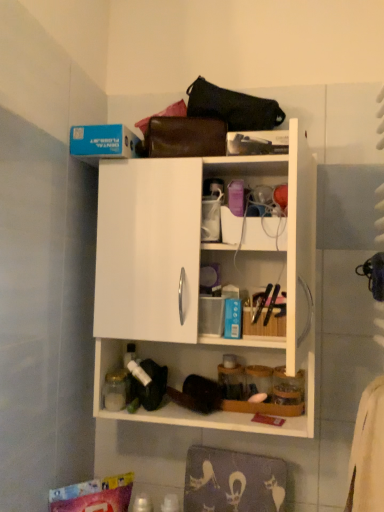
Locate an element on the screen. The image size is (384, 512). black leather handbag at upper center, the first handbag from the top is located at coordinates (232, 106).

Locate an element on the screen. The image size is (384, 512). black leather handbag at upper center, the first handbag from the top is located at coordinates (232, 106).

Between leather handbag at upper center, acting as the second handbag starting from the top, and white matte cabinet at upper center, which one has smaller size?

Smaller between the two is leather handbag at upper center, acting as the second handbag starting from the top.

From the image's perspective, is leather handbag at upper center, acting as the first handbag starting from the bottom, located above white matte cabinet at upper center?

Yes, from the image's perspective, leather handbag at upper center, acting as the first handbag starting from the bottom, is above white matte cabinet at upper center.

Is leather handbag at upper center, acting as the first handbag starting from the bottom, at the left side of white matte cabinet at upper center?

Correct, you'll find leather handbag at upper center, acting as the first handbag starting from the bottom, to the left of white matte cabinet at upper center.

Looking at this image, considering the relative positions of white matte cabinet at upper center and leather handbag at upper center, acting as the second handbag starting from the top, in the image provided, is white matte cabinet at upper center to the right of leather handbag at upper center, acting as the second handbag starting from the top, from the viewer's perspective?

Indeed, white matte cabinet at upper center is positioned on the right side of leather handbag at upper center, acting as the second handbag starting from the top.

Considering the relative sizes of white matte cabinet at upper center and leather handbag at upper center, acting as the second handbag starting from the top, in the image provided, is white matte cabinet at upper center bigger than leather handbag at upper center, acting as the second handbag starting from the top,?

Indeed, white matte cabinet at upper center has a larger size compared to leather handbag at upper center, acting as the second handbag starting from the top.

From their relative heights in the image, would you say white matte cabinet at upper center is taller or shorter than leather handbag at upper center, acting as the second handbag starting from the top?

In the image, white matte cabinet at upper center appears to be taller than leather handbag at upper center, acting as the second handbag starting from the top.

Looking at their sizes, would you say white matte cabinet at upper center is wider or thinner than leather handbag at upper center, acting as the first handbag starting from the bottom?

Clearly, white matte cabinet at upper center has more width compared to leather handbag at upper center, acting as the first handbag starting from the bottom.

Is black leather handbag at upper center, which is the second handbag in bottom-to-top order, far away from white matte cabinet at upper center?

No, black leather handbag at upper center, which is the second handbag in bottom-to-top order, is not far from white matte cabinet at upper center.

Is black leather handbag at upper center, which is the second handbag in bottom-to-top order, wider or thinner than white matte cabinet at upper center?

In the image, black leather handbag at upper center, which is the second handbag in bottom-to-top order, appears to be more narrow than white matte cabinet at upper center.

From a real-world perspective, relative to white matte cabinet at upper center, is black leather handbag at upper center, the first handbag from the top, vertically above or below?

In terms of real-world spatial position, black leather handbag at upper center, the first handbag from the top, is above white matte cabinet at upper center.

Is point (216, 106) farther from camera compared to point (176, 167)?

Yes, point (216, 106) is behind point (176, 167).

From a real-world perspective, is black leather handbag at upper center, which is the second handbag in bottom-to-top order, physically located above or below leather handbag at upper center, acting as the first handbag starting from the bottom?

From a real-world perspective, black leather handbag at upper center, which is the second handbag in bottom-to-top order, is physically above leather handbag at upper center, acting as the first handbag starting from the bottom.

What's the angular difference between black leather handbag at upper center, which is the second handbag in bottom-to-top order, and leather handbag at upper center, acting as the first handbag starting from the bottom,'s facing directions?

They differ by 6.21 degrees in their facing directions.

Does point (249, 111) come in front of point (163, 143)?

Yes, it is in front of point (163, 143).

In the image, is black leather handbag at upper center, the first handbag from the top, positioned in front of or behind leather handbag at upper center, acting as the second handbag starting from the top?

Visually, black leather handbag at upper center, the first handbag from the top, is located in front of leather handbag at upper center, acting as the second handbag starting from the top.

Are leather handbag at upper center, acting as the second handbag starting from the top, and black leather handbag at upper center, the first handbag from the top, located far from each other?

No, leather handbag at upper center, acting as the second handbag starting from the top, is in close proximity to black leather handbag at upper center, the first handbag from the top.

Looking at this image, between leather handbag at upper center, acting as the first handbag starting from the bottom, and black leather handbag at upper center, the first handbag from the top, which one has larger width?

black leather handbag at upper center, the first handbag from the top, is wider.

Could you tell me if leather handbag at upper center, acting as the first handbag starting from the bottom, is facing black leather handbag at upper center, which is the second handbag in bottom-to-top order?

No, leather handbag at upper center, acting as the first handbag starting from the bottom, does not turn towards black leather handbag at upper center, which is the second handbag in bottom-to-top order.

Looking at their sizes, would you say white matte cabinet at upper center is wider or thinner than black leather handbag at upper center, the first handbag from the top?

white matte cabinet at upper center is wider than black leather handbag at upper center, the first handbag from the top.

From their relative heights in the image, would you say white matte cabinet at upper center is taller or shorter than black leather handbag at upper center, which is the second handbag in bottom-to-top order?

white matte cabinet at upper center is taller than black leather handbag at upper center, which is the second handbag in bottom-to-top order.

From the image's perspective, which object appears higher, white matte cabinet at upper center or black leather handbag at upper center, the first handbag from the top?

black leather handbag at upper center, the first handbag from the top, is shown above in the image.

Image resolution: width=384 pixels, height=512 pixels. I want to click on handbag on the left of the white matte cabinet at upper center, so click(185, 137).

Locate an element on the screen. This screenshot has height=512, width=384. cabinetry that appears in front of the leather handbag at upper center, acting as the first handbag starting from the bottom is located at coordinates (199, 270).

Which object lies further to the anchor point leather handbag at upper center, acting as the first handbag starting from the bottom, black leather handbag at upper center, which is the second handbag in bottom-to-top order, or white matte cabinet at upper center?

Based on the image, white matte cabinet at upper center appears to be further to leather handbag at upper center, acting as the first handbag starting from the bottom.

Estimate the real-world distances between objects in this image. Which object is further from leather handbag at upper center, acting as the first handbag starting from the bottom, white matte cabinet at upper center or black leather handbag at upper center, which is the second handbag in bottom-to-top order?

white matte cabinet at upper center lies further to leather handbag at upper center, acting as the first handbag starting from the bottom, than the other object.

Estimate the real-world distances between objects in this image. Which object is closer to white matte cabinet at upper center, leather handbag at upper center, acting as the first handbag starting from the bottom, or black leather handbag at upper center, the first handbag from the top?

leather handbag at upper center, acting as the first handbag starting from the bottom, lies closer to white matte cabinet at upper center than the other object.

Which object lies nearer to the anchor point black leather handbag at upper center, the first handbag from the top, leather handbag at upper center, acting as the second handbag starting from the top, or white matte cabinet at upper center?

The object closer to black leather handbag at upper center, the first handbag from the top, is leather handbag at upper center, acting as the second handbag starting from the top.

From the image, which object appears to be nearer to white matte cabinet at upper center, black leather handbag at upper center, which is the second handbag in bottom-to-top order, or leather handbag at upper center, acting as the second handbag starting from the top?

leather handbag at upper center, acting as the second handbag starting from the top, is closer to white matte cabinet at upper center.

From the image, which object appears to be farther from black leather handbag at upper center, the first handbag from the top, white matte cabinet at upper center or leather handbag at upper center, acting as the second handbag starting from the top?

Among the two, white matte cabinet at upper center is located further to black leather handbag at upper center, the first handbag from the top.

Find the location of a particular element. Image resolution: width=384 pixels, height=512 pixels. handbag between black leather handbag at upper center, the first handbag from the top, and white matte cabinet at upper center in the up-down direction is located at coordinates (185, 137).